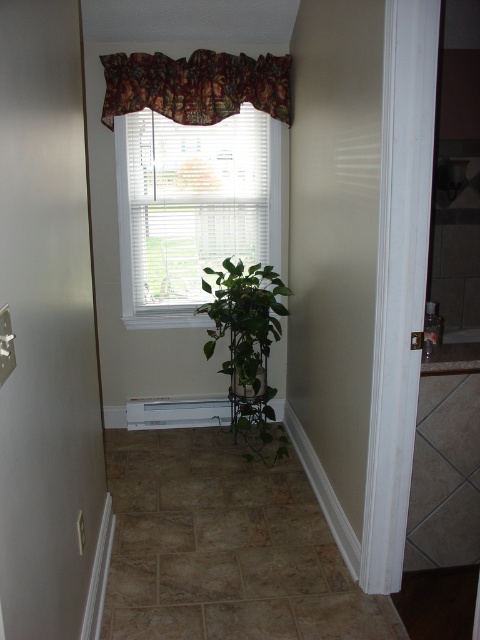
Question: Which point is closer to the camera?

Choices:
 (A) floral fabric valance at upper center
 (B) white blinds at center

Answer: (A)

Question: Estimate the real-world distances between objects in this image. Which object is farther from the white blinds at center?

Choices:
 (A) floral fabric valance at upper center
 (B) green matte plant at center

Answer: (B)

Question: Can you confirm if white blinds at center is positioned to the right of green matte plant at center?

Choices:
 (A) no
 (B) yes

Answer: (A)

Question: Which object is the closest to the white blinds at center?

Choices:
 (A) floral fabric valance at upper center
 (B) green matte plant at center

Answer: (A)

Question: Is floral fabric valance at upper center positioned before green matte plant at center?

Choices:
 (A) no
 (B) yes

Answer: (A)

Question: In this image, where is white blinds at center located relative to green matte plant at center?

Choices:
 (A) below
 (B) above

Answer: (B)